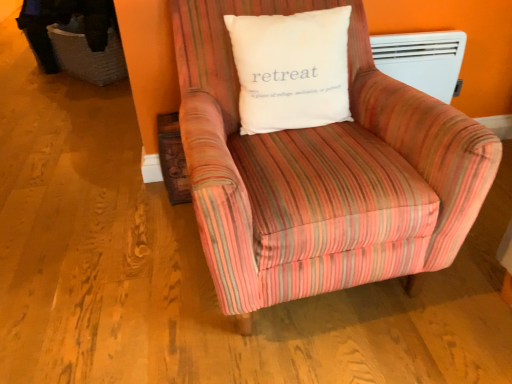
You are a GUI agent. You are given a task and a screenshot of the screen. Output one action in this format:
    pyautogui.click(x=<x>, y=<y>)
    Task: Click on the free space above white plastic heater at upper right (from a real-world perspective)
    The image size is (512, 384).
    Given the screenshot: What is the action you would take?
    pyautogui.click(x=418, y=22)